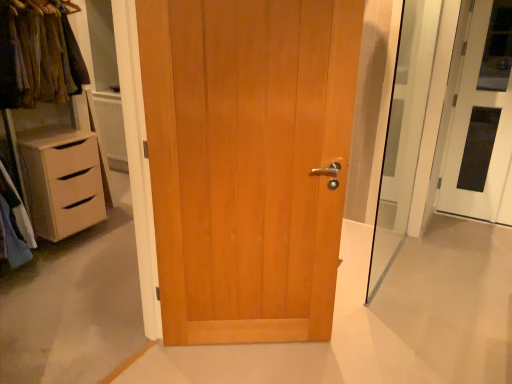
Question: From a real-world perspective, relative to transparent glass screen door at right, is light brown wood door at center, the first door when ordered from front to back, vertically above or below?

Choices:
 (A) above
 (B) below

Answer: (B)

Question: From their relative heights in the image, would you say light brown wood door at center, the 2th door from the right, is taller or shorter than transparent glass screen door at right?

Choices:
 (A) tall
 (B) short

Answer: (B)

Question: Estimate the real-world distances between objects in this image. Which object is farther from the transparent glass screen door at right?

Choices:
 (A) light brown wood door at center, the first door when ordered from front to back
 (B) white glossy door at right, which ranks as the 1th door in right-to-left order

Answer: (A)

Question: Estimate the real-world distances between objects in this image. Which object is farther from the transparent glass screen door at right?

Choices:
 (A) light brown wood door at center, the 1th door in the left-to-right sequence
 (B) white glossy door at right, which ranks as the 1th door in right-to-left order

Answer: (A)